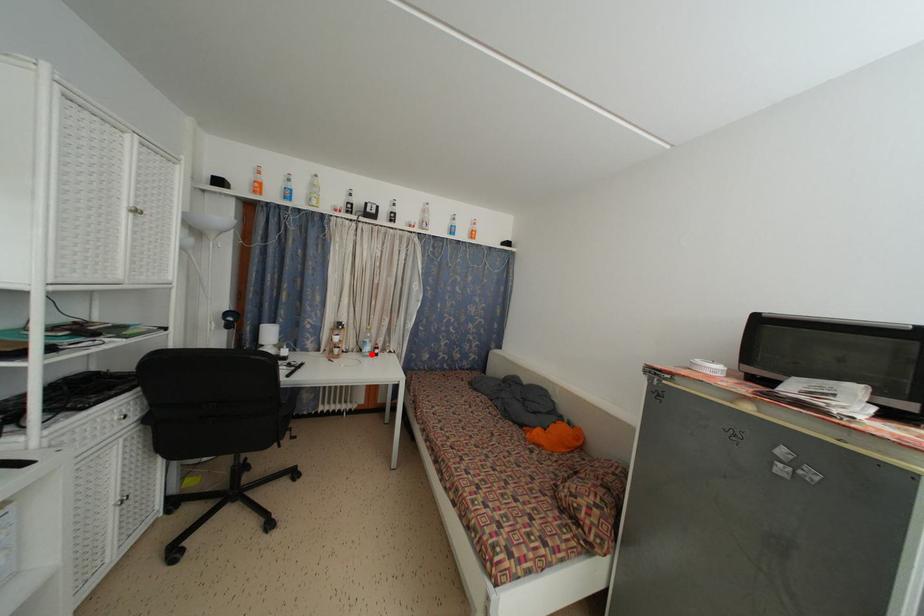
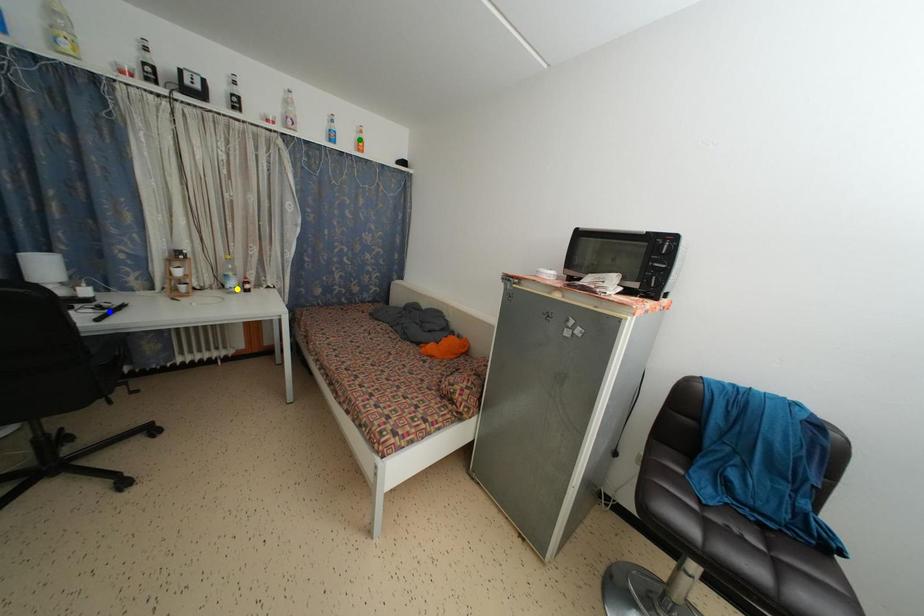
Question: I am providing you with two images of the same scene from different viewpoints. A red point is marked on the first image. You are given multiple points on the second image. Which point in image 2 represents the same 3d spot as the red point in image 1?

Choices:
 (A) blue point
 (B) green point
 (C) yellow point

Answer: (C)